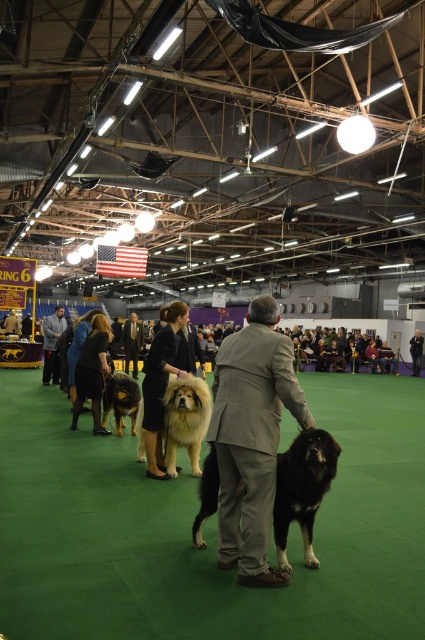
You are a photographer at the dog show and want to take a photo of the fluffy golden dog at center. The camera is set up at point A located at coordinates 0.5,0.5. What direction should you move the camera to align it with the dog?

The fluffy golden dog at center is located at coordinates (x=184, y=419). Since the camera is at (x=212, y=320), you should move the camera to the right and slightly downward to align it with the dog.

You are a judge at the dog show and need to determine the order of the dogs based on their positions. Which dog is positioned closer to the front of the arena, the one at point (x=240, y=577) or the one at point (x=133, y=336)?

The dog at point (x=240, y=577) is positioned closer to the front of the arena than the dog at point (x=133, y=336) since point (x=240, y=577) is in front of point (x=133, y=336).